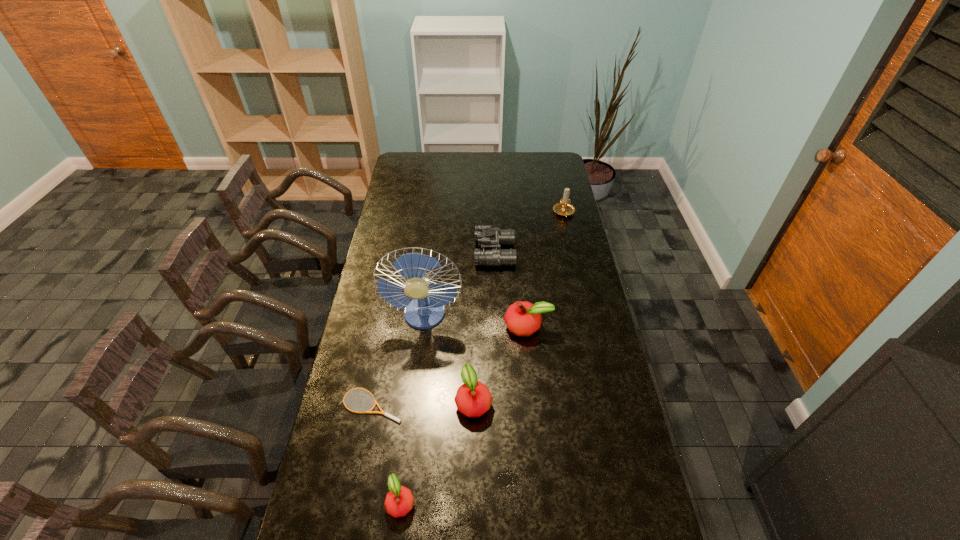
This screenshot has height=540, width=960. I want to click on vacant space that satisfies the following two spatial constraints: 1. on the back side of the tennis racket; 2. on the left side of the second apple from right to left, so click(372, 401).

Locate an element on the screen. This screenshot has height=540, width=960. free space that satisfies the following two spatial constraints: 1. at the front of the fan where the blades are visible; 2. on the right side of the rightmost apple is located at coordinates (423, 326).

The height and width of the screenshot is (540, 960). I want to click on vacant space that satisfies the following two spatial constraints: 1. on the back side of the farthest apple; 2. on the right side of the candle, so pos(516,213).

Image resolution: width=960 pixels, height=540 pixels. Identify the location of free space that satisfies the following two spatial constraints: 1. through the lenses of the second farthest object; 2. at the front of the fan where the blades are visible. (497, 316).

You are a GUI agent. You are given a task and a screenshot of the screen. Output one action in this format:
    pyautogui.click(x=<x>, y=<y>)
    Task: Click on the free space that satisfies the following two spatial constraints: 1. through the lenses of the second farthest object; 2. at the front of the fan where the blades are visible
    
    Given the screenshot: What is the action you would take?
    pyautogui.click(x=497, y=316)